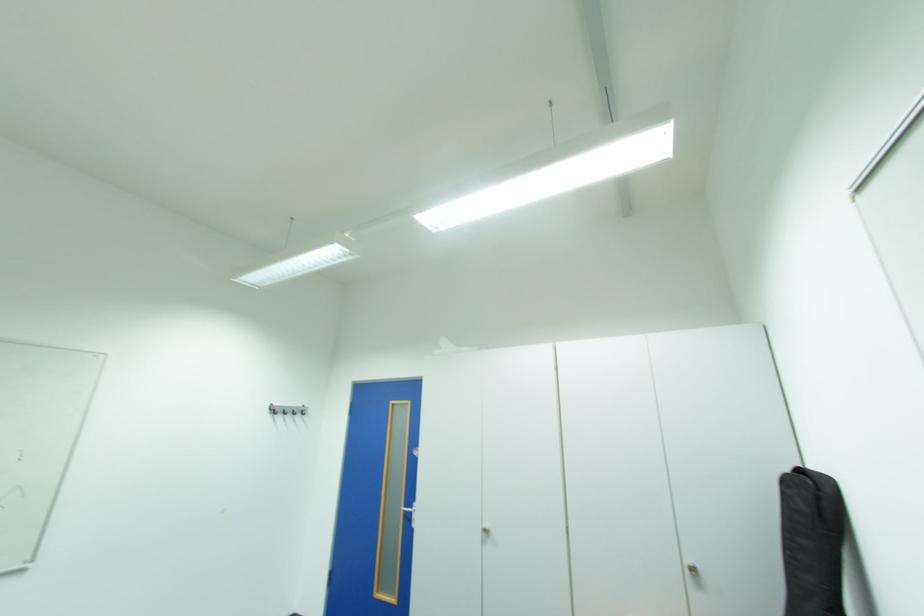
Where is `silver door handle`? This screenshot has height=616, width=924. silver door handle is located at coordinates (411, 514).